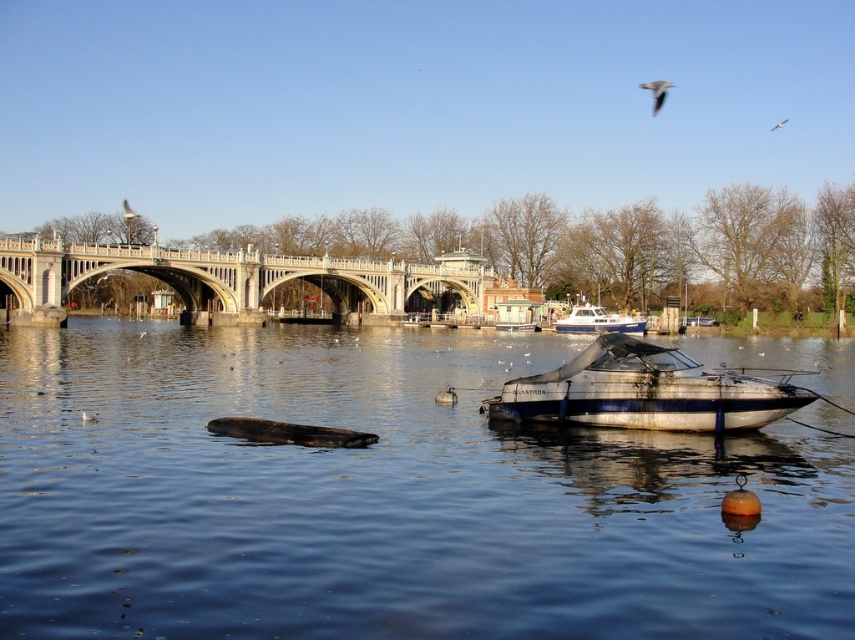
You are a fisherman standing on the riverbank. You see the blue metallic boat at lower center and the brown smooth log at center. Which object is closer to the water surface?

The blue metallic boat at lower center is above the brown smooth log at center, so the boat is closer to the water surface.

You are an ornithologist observing the white feathered bird at upper right and the white stone bridge at center. If the bird wants to land on the bridge, will its wingspan allow it to fit between the bridge and the nearest obstacle? Please explain.

The white stone bridge at center is wider than the white feathered bird at upper right. Since the bridge is wider, the bird can easily fit its wingspan between the bridge and any nearby obstacles without issue.

You are a swimmer who wants to reach the brown smooth log at center from the blue metallic boat at lower center. Given that you can swim at a speed of 1.5 meters per second, how many seconds will it take you to reach the log?

The distance between the blue metallic boat at lower center and the brown smooth log at center is 11.16 meters. At a swimming speed of 1.5 meters per second, the time required would be 11.16 divided by 1.5, which equals approximately 7.44 seconds. Therefore, it will take roughly 7.44 seconds to reach the log.